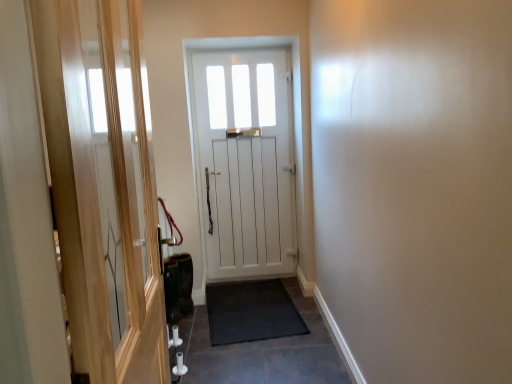
Where is `vacant space underneath white wooden door at center (from a real-world perspective)`? The image size is (512, 384). vacant space underneath white wooden door at center (from a real-world perspective) is located at coordinates (252, 279).